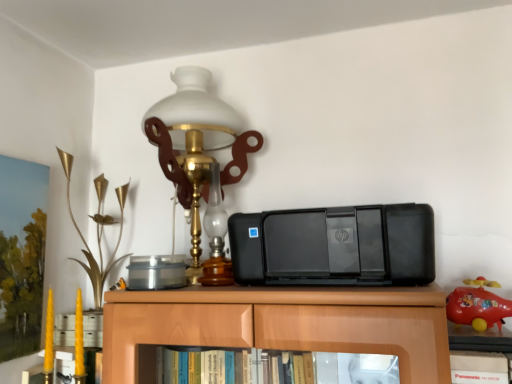
I want to click on rubberized red toy airplane at right, which ranks as the 1th toy in right-to-left order, so click(477, 305).

What do you see at coordinates (97, 228) in the screenshot?
I see `gold metallic flower at left, which appears as the 2th toy when viewed from the front` at bounding box center [97, 228].

Locate an element on the screen. black plastic book at lower right is located at coordinates (478, 367).

Is black plastic book at lower right closer to the viewer compared to gold metallic flower at left, the 2th toy from the right?

Yes.

I want to click on book in front of the gold metallic flower at left, marked as the first toy in a back-to-front arrangement, so click(478, 367).

Can we say black plastic book at lower right lies outside gold metallic flower at left, marked as the first toy in a left-to-right arrangement?

Absolutely, black plastic book at lower right is external to gold metallic flower at left, marked as the first toy in a left-to-right arrangement.

Could you measure the distance between black plastic book at lower right and gold metallic flower at left, marked as the first toy in a left-to-right arrangement?

black plastic book at lower right is 3.37 feet away from gold metallic flower at left, marked as the first toy in a left-to-right arrangement.

Is gold metallic flower at left, which appears as the 2th toy when viewed from the front, taller or shorter than rubberized red toy airplane at right, the second toy viewed from the left?

Clearly, gold metallic flower at left, which appears as the 2th toy when viewed from the front, is taller compared to rubberized red toy airplane at right, the second toy viewed from the left.

Could you measure the distance between gold metallic flower at left, the 2th toy from the right, and rubberized red toy airplane at right, which ranks as the 1th toy in right-to-left order?

gold metallic flower at left, the 2th toy from the right, is 1.00 meters away from rubberized red toy airplane at right, which ranks as the 1th toy in right-to-left order.

Is gold metallic flower at left, which appears as the 2th toy when viewed from the front, positioned far away from rubberized red toy airplane at right, marked as the 1th toy in a front-to-back arrangement?

gold metallic flower at left, which appears as the 2th toy when viewed from the front, is positioned a significant distance from rubberized red toy airplane at right, marked as the 1th toy in a front-to-back arrangement.

Is gold metallic flower at left, the 2th toy from the right, situated inside rubberized red toy airplane at right, the second toy viewed from the left, or outside?

gold metallic flower at left, the 2th toy from the right, is located beyond the bounds of rubberized red toy airplane at right, the second toy viewed from the left.

Can you confirm if black plastic book at lower right is taller than black plastic printer at center?

No.

Is black plastic book at lower right facing away from black plastic printer at center?

That's not correct — black plastic book at lower right is not looking away from black plastic printer at center.

Relative to black plastic printer at center, is black plastic book at lower right in front or behind?

black plastic book at lower right is in front of black plastic printer at center.

Is black plastic book at lower right to the left of black plastic printer at center from the viewer's perspective?

Incorrect, black plastic book at lower right is not on the left side of black plastic printer at center.

Is matte glass lamp at upper center facing towards black plastic printer at center?

No, matte glass lamp at upper center is not oriented towards black plastic printer at center.

Which is farther, [169,143] or [359,284]?

Positioned behind is point [169,143].

Consider the image. Considering the relative sizes of matte glass lamp at upper center and black plastic printer at center in the image provided, is matte glass lamp at upper center thinner than black plastic printer at center?

In fact, matte glass lamp at upper center might be wider than black plastic printer at center.

Does matte glass lamp at upper center have a smaller size compared to black plastic printer at center?

Actually, matte glass lamp at upper center might be larger than black plastic printer at center.

From the image's perspective, would you say rubberized red toy airplane at right, marked as the 1th toy in a front-to-back arrangement, is shown under matte glass lamp at upper center?

Yes, from the image's perspective, rubberized red toy airplane at right, marked as the 1th toy in a front-to-back arrangement, is below matte glass lamp at upper center.

Looking at this image, can you tell me how much rubberized red toy airplane at right, the second toy viewed from the left, and matte glass lamp at upper center differ in facing direction?

The angular difference between rubberized red toy airplane at right, the second toy viewed from the left, and matte glass lamp at upper center is 8.61 degrees.

Can you confirm if rubberized red toy airplane at right, which ranks as the 1th toy in right-to-left order, is taller than matte glass lamp at upper center?

No, rubberized red toy airplane at right, which ranks as the 1th toy in right-to-left order, is not taller than matte glass lamp at upper center.

Is rubberized red toy airplane at right, marked as the 1th toy in a front-to-back arrangement, positioned far away from matte glass lamp at upper center?

No, rubberized red toy airplane at right, marked as the 1th toy in a front-to-back arrangement, is not far from matte glass lamp at upper center.

In the scene shown: Is there a large distance between rubberized red toy airplane at right, marked as the 2th toy in a back-to-front arrangement, and black plastic printer at center?

rubberized red toy airplane at right, marked as the 2th toy in a back-to-front arrangement, is near black plastic printer at center, not far away.

Is rubberized red toy airplane at right, marked as the 2th toy in a back-to-front arrangement, facing away from black plastic printer at center?

No, black plastic printer at center is not at the back of rubberized red toy airplane at right, marked as the 2th toy in a back-to-front arrangement.

How much distance is there between rubberized red toy airplane at right, which ranks as the 1th toy in right-to-left order, and black plastic printer at center?

11.63 inches.

Does rubberized red toy airplane at right, which ranks as the 1th toy in right-to-left order, have a larger size compared to black plastic printer at center?

Incorrect, rubberized red toy airplane at right, which ranks as the 1th toy in right-to-left order, is not larger than black plastic printer at center.

Is gold metallic flower at left, the 2th toy from the right, not near black plastic printer at center?

Actually, gold metallic flower at left, the 2th toy from the right, and black plastic printer at center are a little close together.

Does gold metallic flower at left, marked as the first toy in a back-to-front arrangement, have a greater height compared to black plastic printer at center?

Correct, gold metallic flower at left, marked as the first toy in a back-to-front arrangement, is much taller as black plastic printer at center.

Measure the distance from gold metallic flower at left, marked as the first toy in a left-to-right arrangement, to black plastic printer at center.

gold metallic flower at left, marked as the first toy in a left-to-right arrangement, is 26.81 inches away from black plastic printer at center.

Looking at this image, is gold metallic flower at left, marked as the first toy in a back-to-front arrangement, not within black plastic printer at center?

That's correct, gold metallic flower at left, marked as the first toy in a back-to-front arrangement, is outside of black plastic printer at center.

From the image's perspective, count 2nd toys upward from the black plastic book at lower right and point to it. Please provide its 2D coordinates.

[(97, 228)]

Where is `toy that is on the right side of gold metallic flower at left, marked as the first toy in a left-to-right arrangement`? toy that is on the right side of gold metallic flower at left, marked as the first toy in a left-to-right arrangement is located at coordinates (477, 305).

Which object lies further to the anchor point gold metallic flower at left, marked as the first toy in a left-to-right arrangement, black plastic book at lower right or black plastic printer at center?

Based on the image, black plastic book at lower right appears to be further to gold metallic flower at left, marked as the first toy in a left-to-right arrangement.

Estimate the real-world distances between objects in this image. Which object is closer to black plastic book at lower right, matte glass lamp at upper center or black plastic printer at center?

→ black plastic printer at center.

Based on their spatial positions, is rubberized red toy airplane at right, marked as the 1th toy in a front-to-back arrangement, or gold metallic flower at left, marked as the first toy in a left-to-right arrangement, closer to black plastic book at lower right?

The object closer to black plastic book at lower right is rubberized red toy airplane at right, marked as the 1th toy in a front-to-back arrangement.

Looking at the image, which one is located closer to rubberized red toy airplane at right, marked as the 2th toy in a back-to-front arrangement, black plastic book at lower right or matte glass lamp at upper center?

black plastic book at lower right lies closer to rubberized red toy airplane at right, marked as the 2th toy in a back-to-front arrangement, than the other object.

Based on their spatial positions, is rubberized red toy airplane at right, the second toy viewed from the left, or black plastic printer at center further from matte glass lamp at upper center?

The object further to matte glass lamp at upper center is rubberized red toy airplane at right, the second toy viewed from the left.

Estimate the real-world distances between objects in this image. Which object is further from gold metallic flower at left, which appears as the 2th toy when viewed from the front, rubberized red toy airplane at right, marked as the 1th toy in a front-to-back arrangement, or matte glass lamp at upper center?

rubberized red toy airplane at right, marked as the 1th toy in a front-to-back arrangement, lies further to gold metallic flower at left, which appears as the 2th toy when viewed from the front, than the other object.

From the image, which object appears to be farther from rubberized red toy airplane at right, which ranks as the 1th toy in right-to-left order, black plastic book at lower right or black plastic printer at center?

Among the two, black plastic printer at center is located further to rubberized red toy airplane at right, which ranks as the 1th toy in right-to-left order.

Based on their spatial positions, is rubberized red toy airplane at right, the second toy viewed from the left, or black plastic printer at center closer to gold metallic flower at left, the 2th toy from the right?

The object closer to gold metallic flower at left, the 2th toy from the right, is black plastic printer at center.

Locate an element on the screen. This screenshot has width=512, height=384. book between matte glass lamp at upper center and rubberized red toy airplane at right, the second toy viewed from the left is located at coordinates (478, 367).

Where is `printer located between gold metallic flower at left, which appears as the 2th toy when viewed from the front, and black plastic book at lower right in the left-right direction`? printer located between gold metallic flower at left, which appears as the 2th toy when viewed from the front, and black plastic book at lower right in the left-right direction is located at coordinates (335, 246).

The width and height of the screenshot is (512, 384). Find the location of `book between black plastic printer at center and rubberized red toy airplane at right, which ranks as the 1th toy in right-to-left order, from left to right`. book between black plastic printer at center and rubberized red toy airplane at right, which ranks as the 1th toy in right-to-left order, from left to right is located at coordinates (478, 367).

At what (x,y) coordinates should I click in order to perform the action: click on printer located between gold metallic flower at left, the 2th toy from the right, and rubberized red toy airplane at right, marked as the 1th toy in a front-to-back arrangement, in the left-right direction. Please return your answer as a coordinate pair (x, y). This screenshot has height=384, width=512. Looking at the image, I should click on (335, 246).